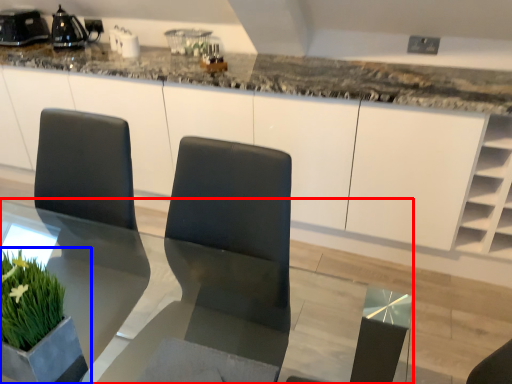
Question: Which object appears closest to the camera in this image, table (highlighted by a red box) or houseplant (highlighted by a blue box)?

Choices:
 (A) table
 (B) houseplant

Answer: (A)